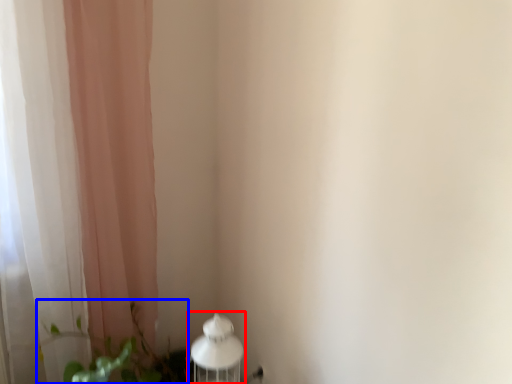
Question: Which object is further to the camera taking this photo, table lamp (highlighted by a red box) or plant (highlighted by a blue box)?

Choices:
 (A) table lamp
 (B) plant

Answer: (A)